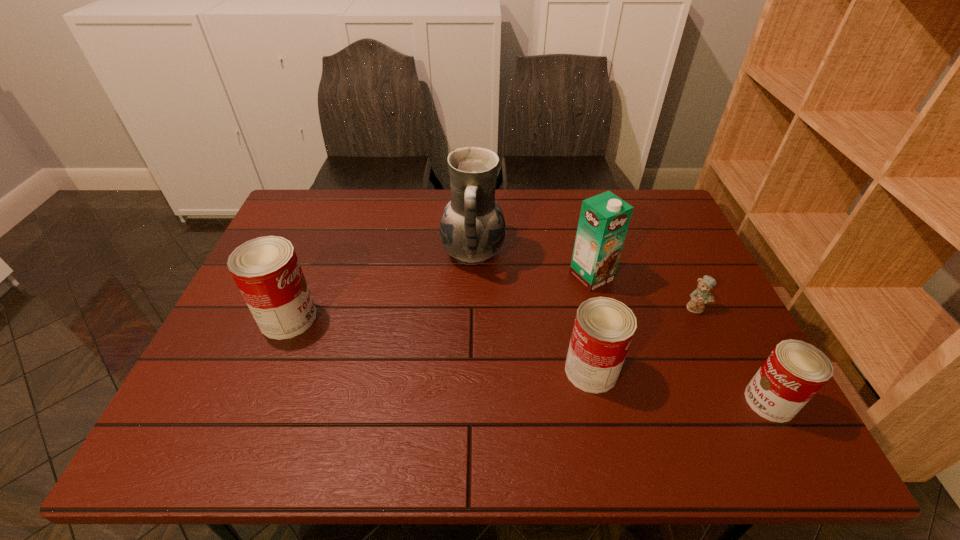
Find the location of a particular element. This screenshot has width=960, height=540. free spot located 0.070m on the front label of the leftmost can is located at coordinates (344, 318).

This screenshot has width=960, height=540. What are the coordinates of `vacant space situated on the front label of the second tallest can` in the screenshot? It's located at (670, 370).

The image size is (960, 540). Identify the location of vacant space situated on the front label of the shortest can. (603, 401).

Where is `blank area located 0.250m on the front label of the shortest can`? blank area located 0.250m on the front label of the shortest can is located at coordinates click(631, 401).

The width and height of the screenshot is (960, 540). Find the location of `free space located 0.250m on the front label of the shortest can`. free space located 0.250m on the front label of the shortest can is located at coordinates (631, 401).

Where is `blank space located on the front-facing side of the tallest object`? The width and height of the screenshot is (960, 540). blank space located on the front-facing side of the tallest object is located at coordinates (559, 253).

Identify the location of free space located 0.270m on the left of the carton. Image resolution: width=960 pixels, height=540 pixels. (473, 276).

This screenshot has height=540, width=960. What are the coordinates of `vacant area located 0.250m on the front-facing side of the teddy bear` in the screenshot? It's located at (741, 403).

The image size is (960, 540). Find the location of `object that is at the far edge`. object that is at the far edge is located at coordinates (472, 229).

Image resolution: width=960 pixels, height=540 pixels. What are the coordinates of `object that is at the left edge` in the screenshot? It's located at click(266, 270).